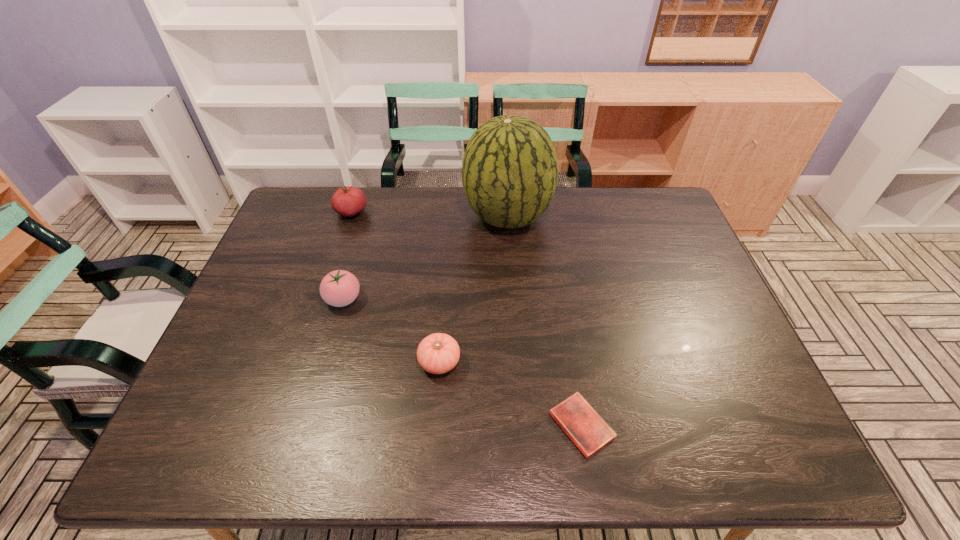
Find the location of a particular element. This screenshot has height=540, width=960. vacant space situated on the right of the nearest tomato is located at coordinates (489, 362).

The height and width of the screenshot is (540, 960). Find the location of `vacant space situated 0.380m on the back of the nearest object`. vacant space situated 0.380m on the back of the nearest object is located at coordinates (557, 276).

In order to click on watermelon at the far edge in this screenshot , I will do `click(510, 169)`.

The height and width of the screenshot is (540, 960). What are the coordinates of `tomato positioned at the far edge` in the screenshot? It's located at (347, 201).

The image size is (960, 540). In order to click on object present at the near edge in this screenshot , I will do `click(578, 419)`.

You are a GUI agent. You are given a task and a screenshot of the screen. Output one action in this format:
    pyautogui.click(x=<x>, y=<y>)
    Task: Click on the free space at the far edge of the desktop
    The image size is (960, 540).
    Given the screenshot: What is the action you would take?
    pos(465,224)

In the image, there is a desktop. Where is `vacant area at the near edge`? The width and height of the screenshot is (960, 540). vacant area at the near edge is located at coordinates (360, 443).

Find the location of `free region at the left edge`. free region at the left edge is located at coordinates (263, 313).

Image resolution: width=960 pixels, height=540 pixels. In the image, there is a desktop. In order to click on free space at the right edge in this screenshot , I will do 726,367.

Locate an element on the screen. This screenshot has width=960, height=540. blank space at the near left corner of the desktop is located at coordinates (242, 449).